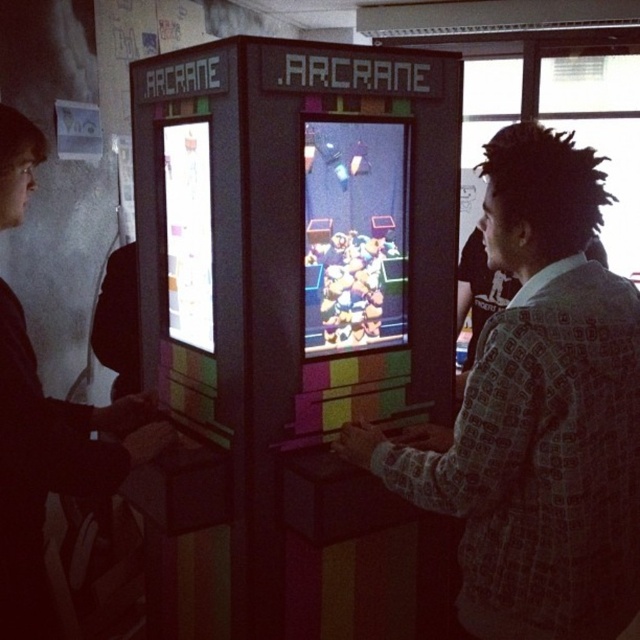
In the scene shown: Does patterned shirt at center have a lesser width compared to dark gray sweater at left?

No, patterned shirt at center is not thinner than dark gray sweater at left.

Which of these two, patterned shirt at center or dark gray sweater at left, stands taller?

patterned shirt at center

I want to click on patterned shirt at center, so [538, 413].